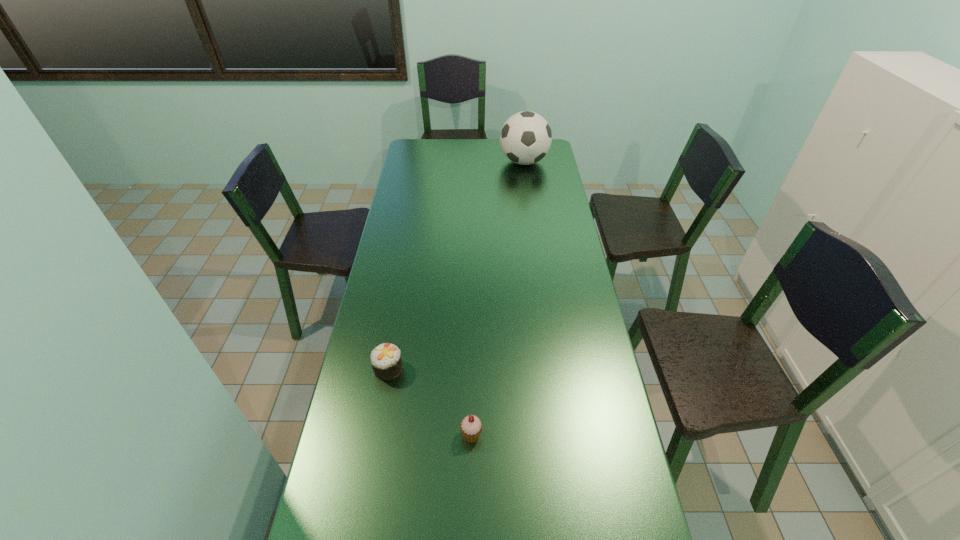
Where is `free point between the right cupcake and the tallest object`? free point between the right cupcake and the tallest object is located at coordinates (497, 298).

Find the location of `free space between the nearest object and the leftmost object`. free space between the nearest object and the leftmost object is located at coordinates (430, 402).

Locate an element on the screen. The image size is (960, 540). empty location between the nearer cupcake and the farther cupcake is located at coordinates (430, 402).

This screenshot has height=540, width=960. I want to click on the second closest object relative to the second farthest object, so click(x=525, y=138).

Identify which object is the second closest to the second farthest object. Please provide its 2D coordinates. Your answer should be formatted as a tuple, i.e. [(x, y)], where the tuple contains the x and y coordinates of a point satisfying the conditions above.

[(525, 138)]

You are a GUI agent. You are given a task and a screenshot of the screen. Output one action in this format:
    pyautogui.click(x=<x>, y=<y>)
    Task: Click on the cupcake that is the closest to the soccer ball
    
    Given the screenshot: What is the action you would take?
    pyautogui.click(x=386, y=362)

Identify the location of free space in the image that satisfies the following two spatial constraints: 1. on the back side of the farthest object; 2. on the right side of the nearer cupcake. This screenshot has width=960, height=540. (475, 162).